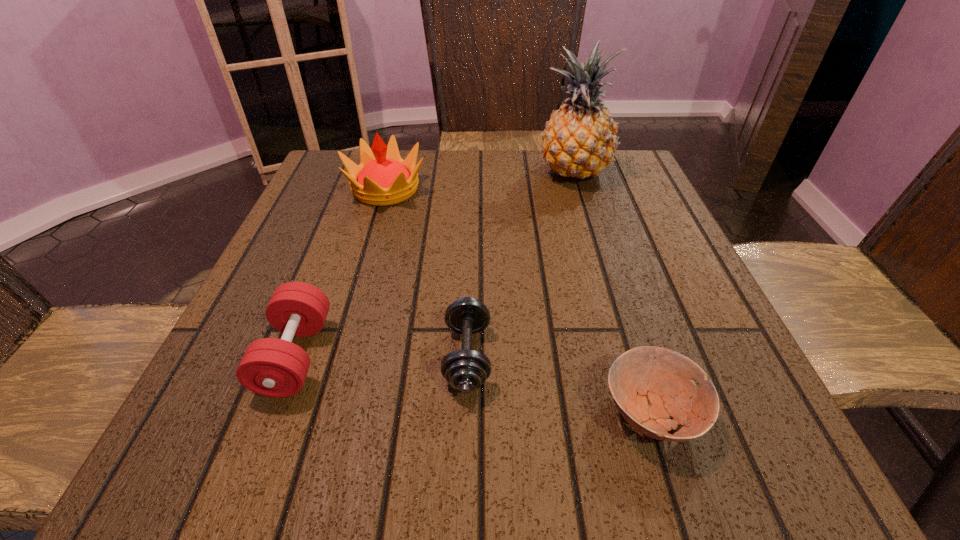
The height and width of the screenshot is (540, 960). I want to click on vacant region between the tallest object and the fourth shortest object, so click(x=480, y=181).

Image resolution: width=960 pixels, height=540 pixels. What are the coordinates of `blank region between the pineapple and the second tallest object` in the screenshot? It's located at (x=480, y=181).

Image resolution: width=960 pixels, height=540 pixels. Find the location of `vacant space in between the tallest object and the left dumbbell`. vacant space in between the tallest object and the left dumbbell is located at coordinates (435, 264).

Locate an element on the screen. This screenshot has height=540, width=960. free space between the pineapple and the right dumbbell is located at coordinates click(520, 265).

This screenshot has width=960, height=540. I want to click on vacant region between the crown and the third object from left to right, so click(x=426, y=272).

The width and height of the screenshot is (960, 540). Identify the location of vacant area between the third tallest object and the pineapple. (435, 264).

What are the coordinates of `the closest object to the tallest object` in the screenshot? It's located at (383, 178).

Locate which object is the closest to the right dumbbell. Please provide its 2D coordinates. Your answer should be formatted as a tuple, i.e. [(x, y)], where the tuple contains the x and y coordinates of a point satisfying the conditions above.

[(649, 385)]

Locate an element on the screen. vacant region that satisfies the following two spatial constraints: 1. on the back side of the left dumbbell; 2. on the left side of the fourth shortest object is located at coordinates (358, 189).

This screenshot has height=540, width=960. Identify the location of free point that satisfies the following two spatial constraints: 1. on the front side of the bowl; 2. on the right side of the shorter dumbbell. (x=466, y=413).